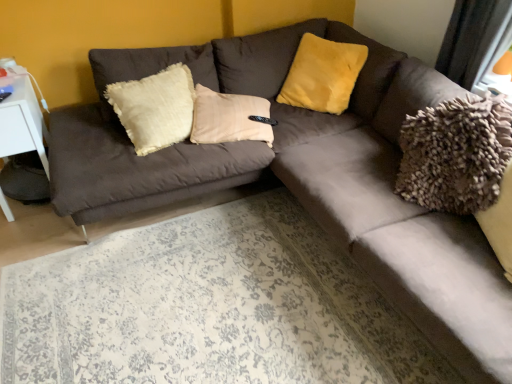
Measure the distance between point [7,212] and camera.

The distance of point [7,212] from camera is 7.80 feet.

Image resolution: width=512 pixels, height=384 pixels. Find the location of `white plastic table at left`. white plastic table at left is located at coordinates pos(22,119).

Describe the element at coordinates (22, 119) in the screenshot. This screenshot has height=384, width=512. I see `white plastic table at left` at that location.

This screenshot has height=384, width=512. What do you see at coordinates (323, 74) in the screenshot?
I see `yellow fuzzy pillow at upper center` at bounding box center [323, 74].

You are a GUI agent. You are given a task and a screenshot of the screen. Output one action in this format:
    pyautogui.click(x=<x>, y=<y>)
    Task: Click on the yellow fuzzy pillow at upper center
    
    Given the screenshot: What is the action you would take?
    pyautogui.click(x=323, y=74)

Find the location of a particular element. Image resolution: width=512 pixels, height=384 pixels. white plastic table at left is located at coordinates (22, 119).

Is white plastic table at left to the right of yellow fuzzy pillow at upper center from the viewer's perspective?

No, white plastic table at left is not to the right of yellow fuzzy pillow at upper center.

Relative to yellow fuzzy pillow at upper center, is white plastic table at left in front or behind?

Clearly, white plastic table at left is in front of yellow fuzzy pillow at upper center.

Which is in front, point (45, 158) or point (334, 43)?

The point (45, 158) is closer to the camera.

From the image's perspective, is white plastic table at left below yellow fuzzy pillow at upper center?

Yes.

From a real-world perspective, who is located lower, white plastic table at left or yellow fuzzy pillow at upper center?

In real-world perspective, white plastic table at left is lower.

In terms of width, does white plastic table at left look wider or thinner when compared to yellow fuzzy pillow at upper center?

Clearly, white plastic table at left has more width compared to yellow fuzzy pillow at upper center.

Who is taller, white plastic table at left or yellow fuzzy pillow at upper center?

With more height is white plastic table at left.

Is white plastic table at left bigger than yellow fuzzy pillow at upper center?

Indeed, white plastic table at left has a larger size compared to yellow fuzzy pillow at upper center.

Would you say white plastic table at left contains yellow fuzzy pillow at upper center?

That's incorrect, yellow fuzzy pillow at upper center is not inside white plastic table at left.

Is white plastic table at left with yellow fuzzy pillow at upper center?

No, white plastic table at left is not in contact with yellow fuzzy pillow at upper center.

Is white plastic table at left turned away from yellow fuzzy pillow at upper center?

white plastic table at left is not turned away from yellow fuzzy pillow at upper center.

The width and height of the screenshot is (512, 384). In order to click on pillow positioned vertically above the white plastic table at left (from a real-world perspective) in this screenshot , I will do `click(323, 74)`.

Which object is positioned more to the right, yellow fuzzy pillow at upper center or white plastic table at left?

yellow fuzzy pillow at upper center is more to the right.

Is yellow fuzzy pillow at upper center further to the viewer compared to white plastic table at left?

That is True.

Is point (345, 70) closer to camera compared to point (15, 93)?

No, it is behind (15, 93).

From the image's perspective, is yellow fuzzy pillow at upper center positioned above or below white plastic table at left?

yellow fuzzy pillow at upper center is situated higher than white plastic table at left in the image.

From a real-world perspective, is yellow fuzzy pillow at upper center beneath white plastic table at left?

No.

Which of these two, yellow fuzzy pillow at upper center or white plastic table at left, is thinner?

With smaller width is yellow fuzzy pillow at upper center.

Which of these two, yellow fuzzy pillow at upper center or white plastic table at left, stands shorter?

Standing shorter between the two is yellow fuzzy pillow at upper center.

Can you confirm if yellow fuzzy pillow at upper center is bigger than white plastic table at left?

Incorrect, yellow fuzzy pillow at upper center is not larger than white plastic table at left.

In the scene shown: Would you say yellow fuzzy pillow at upper center is inside or outside white plastic table at left?

yellow fuzzy pillow at upper center cannot be found inside white plastic table at left.

Is yellow fuzzy pillow at upper center next to white plastic table at left and touching it?

yellow fuzzy pillow at upper center and white plastic table at left are clearly separated.

Is yellow fuzzy pillow at upper center facing towards white plastic table at left?

No, yellow fuzzy pillow at upper center is not oriented towards white plastic table at left.

How different are the orientations of yellow fuzzy pillow at upper center and white plastic table at left in degrees?

The angle between the facing direction of yellow fuzzy pillow at upper center and the facing direction of white plastic table at left is 54.4 degrees.

Consider the image. Measure the distance from yellow fuzzy pillow at upper center to white plastic table at left.

yellow fuzzy pillow at upper center and white plastic table at left are 1.52 meters apart from each other.

You are a GUI agent. You are given a task and a screenshot of the screen. Output one action in this format:
    pyautogui.click(x=<x>, y=<y>)
    Task: Click on the pillow that is above the white plastic table at left (from the image's perspective)
    
    Given the screenshot: What is the action you would take?
    pyautogui.click(x=323, y=74)

This screenshot has height=384, width=512. What are the coordinates of `pillow that is above the white plastic table at left (from the image's perspective)` in the screenshot? It's located at (323, 74).

You are a GUI agent. You are given a task and a screenshot of the screen. Output one action in this format:
    pyautogui.click(x=<x>, y=<y>)
    Task: Click on the pillow on the right of white plastic table at left
    
    Given the screenshot: What is the action you would take?
    pyautogui.click(x=323, y=74)